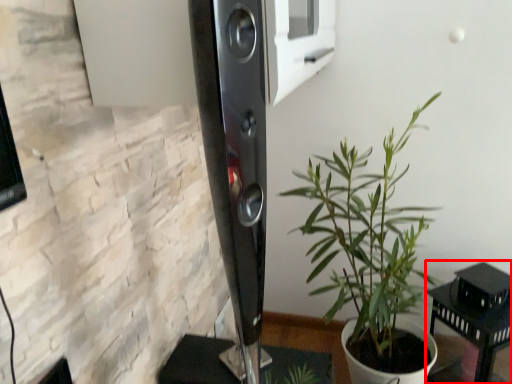
Question: From the image's perspective, what is the correct spatial positioning of furniture (annotated by the red box) in reference to houseplant?

Choices:
 (A) above
 (B) below

Answer: (B)